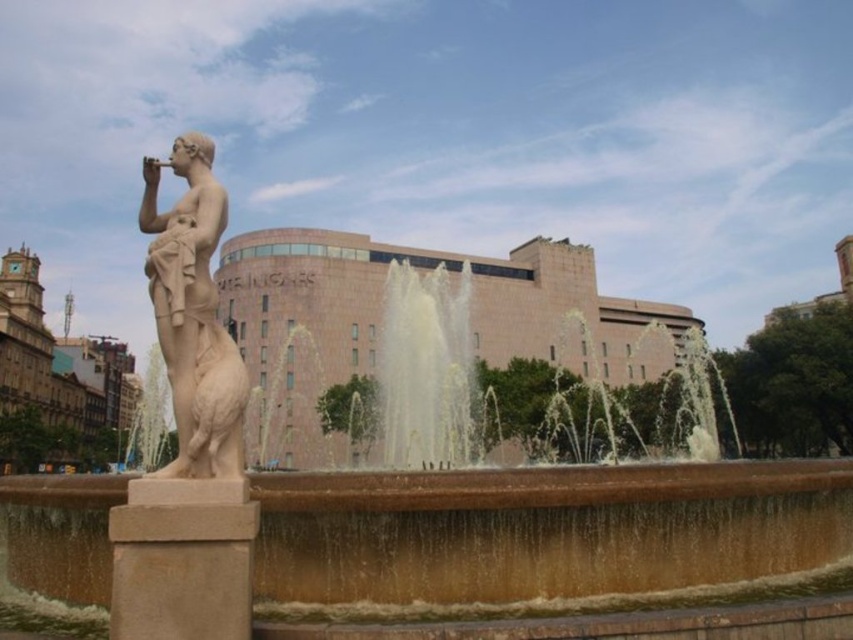
Question: Does brown stone fountain at center have a larger size compared to white marble statue at left?

Choices:
 (A) yes
 (B) no

Answer: (A)

Question: Can you confirm if brown stone fountain at center is thinner than white marble statue at left?

Choices:
 (A) no
 (B) yes

Answer: (A)

Question: Which point is closer to the camera?

Choices:
 (A) (x=848, y=566)
 (B) (x=202, y=381)

Answer: (B)

Question: Is brown stone fountain at center smaller than white marble statue at left?

Choices:
 (A) no
 (B) yes

Answer: (A)